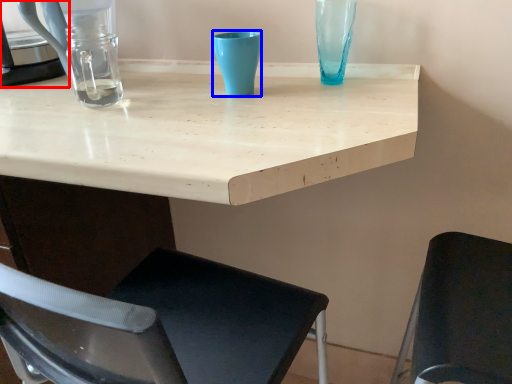
Question: Which object appears farthest to the camera in this image, appliance (highlighted by a red box) or turquoise (highlighted by a blue box)?

Choices:
 (A) appliance
 (B) turquoise

Answer: (A)